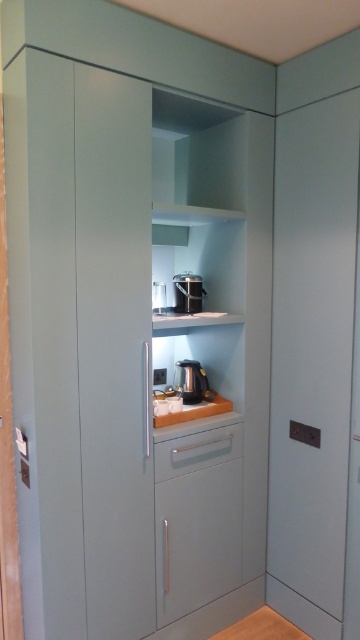
Does orange matte counter top at center appear under matte black coffee maker at center?

Correct, orange matte counter top at center is located below matte black coffee maker at center.

Does orange matte counter top at center appear on the right side of matte black coffee maker at center?

Yes, orange matte counter top at center is to the right of matte black coffee maker at center.

Does point (203, 404) lie behind point (151, 301)?

Yes, point (203, 404) is behind point (151, 301).

Image resolution: width=360 pixels, height=640 pixels. What are the coordinates of `orange matte counter top at center` in the screenshot? It's located at (195, 412).

Does satin black coffee maker at center have a smaller size compared to matte black coffee maker at center?

Actually, satin black coffee maker at center might be larger than matte black coffee maker at center.

Between point (191, 298) and point (151, 296), which one is positioned in front?

Point (151, 296)

At what (x,y) coordinates should I click in order to perform the action: click on satin black coffee maker at center. Please return your answer as a coordinate pair (x, y). Looking at the image, I should click on (187, 291).

Measure the distance between matte gray drawer at center and orange matte counter top at center.

The distance of matte gray drawer at center from orange matte counter top at center is 4.91 inches.

Is point (195, 440) positioned in front of point (209, 412)?

That is True.

The image size is (360, 640). Identify the location of matte gray drawer at center. (196, 451).